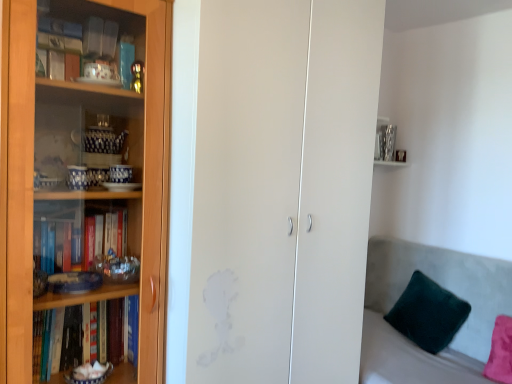
Question: From the image's perspective, is velvet grey couch at right above transparent glass cabinet at left?

Choices:
 (A) no
 (B) yes

Answer: (A)

Question: From a real-world perspective, is velvet grey couch at right below transparent glass cabinet at left?

Choices:
 (A) no
 (B) yes

Answer: (B)

Question: Can transparent glass cabinet at left be found inside velvet grey couch at right?

Choices:
 (A) no
 (B) yes

Answer: (A)

Question: Does velvet grey couch at right have a lesser height compared to transparent glass cabinet at left?

Choices:
 (A) yes
 (B) no

Answer: (A)

Question: Is velvet grey couch at right further to the viewer compared to transparent glass cabinet at left?

Choices:
 (A) yes
 (B) no

Answer: (A)

Question: From the image's perspective, is velvet grey couch at right beneath transparent glass cabinet at left?

Choices:
 (A) no
 (B) yes

Answer: (B)

Question: Can you confirm if transparent glass cabinet at left is positioned to the right of wooden bookcase at left?

Choices:
 (A) yes
 (B) no

Answer: (A)

Question: Does transparent glass cabinet at left have a lesser height compared to wooden bookcase at left?

Choices:
 (A) yes
 (B) no

Answer: (B)

Question: Could you tell me if transparent glass cabinet at left is facing wooden bookcase at left?

Choices:
 (A) yes
 (B) no

Answer: (B)

Question: From the image's perspective, is transparent glass cabinet at left above wooden bookcase at left?

Choices:
 (A) yes
 (B) no

Answer: (A)

Question: Is transparent glass cabinet at left with wooden bookcase at left?

Choices:
 (A) no
 (B) yes

Answer: (A)

Question: Is transparent glass cabinet at left surrounding wooden bookcase at left?

Choices:
 (A) no
 (B) yes

Answer: (A)

Question: Is transparent glass cabinet at left to the right of velvety green pillow at lower right from the viewer's perspective?

Choices:
 (A) no
 (B) yes

Answer: (A)